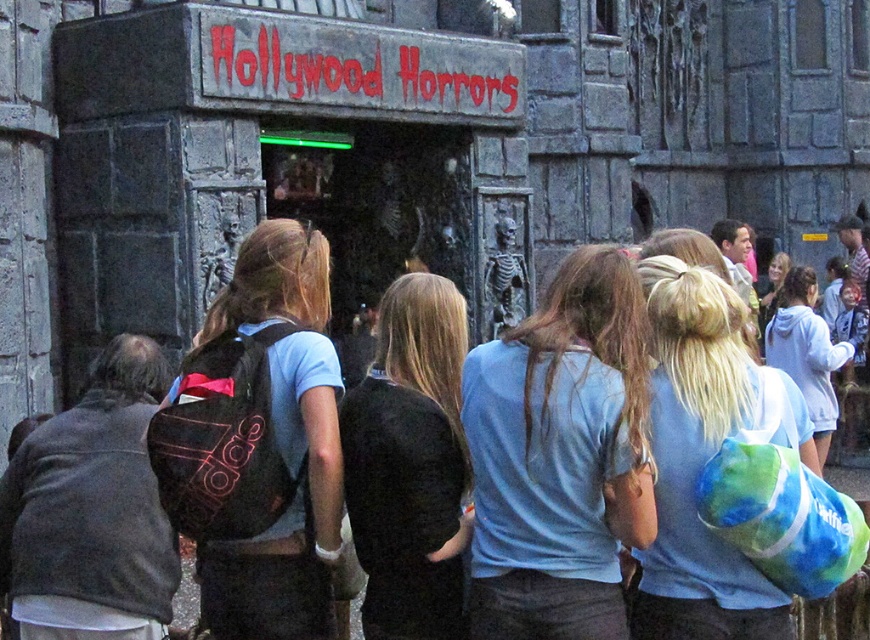
Does dark gray sweater at left appear on the left side of white tie-dye hoodie at upper right?

Yes, dark gray sweater at left is to the left of white tie-dye hoodie at upper right.

Measure the distance between dark gray sweater at left and camera.

The distance of dark gray sweater at left from camera is 89.39 feet.

The width and height of the screenshot is (870, 640). In order to click on dark gray sweater at left in this screenshot , I will do `click(91, 509)`.

Which of these two, blue tie-dye backpack at center-right or white tie-dye hoodie at upper right, stands shorter?

blue tie-dye backpack at center-right is shorter.

Between blue tie-dye backpack at center-right and white tie-dye hoodie at upper right, which one is positioned lower?

Answer: blue tie-dye backpack at center-right

Between point (726, 371) and point (770, 364), which one is positioned in front?

Positioned in front is point (726, 371).

Identify the location of blue tie-dye backpack at center-right. (705, 458).

Is point (114, 630) less distant than point (417, 337)?

Yes, point (114, 630) is in front of point (417, 337).

Does dark gray sweater at left appear on the right side of black fabric shirt at center?

No, dark gray sweater at left is not to the right of black fabric shirt at center.

Who is more distant from viewer, [151,602] or [402,460]?

Point [402,460]

Find the location of `dark gray sweater at left`. dark gray sweater at left is located at coordinates (91, 509).